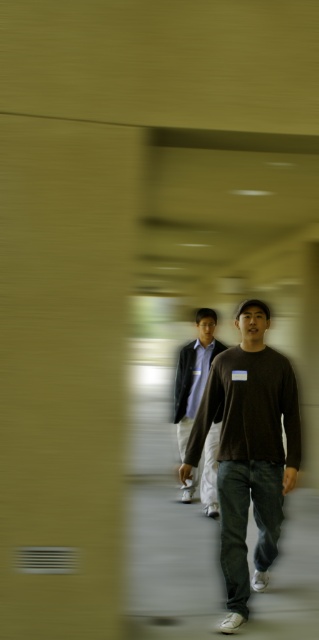
Question: Can you confirm if dark brown cotton shirt at center is bigger than matte gray sweater at center?

Choices:
 (A) no
 (B) yes

Answer: (A)

Question: Does dark brown cotton shirt at center come in front of matte gray sweater at center?

Choices:
 (A) yes
 (B) no

Answer: (A)

Question: Which point appears closest to the camera in this image?

Choices:
 (A) (x=198, y=374)
 (B) (x=213, y=413)

Answer: (B)

Question: Can you confirm if dark brown cotton shirt at center is wider than matte gray sweater at center?

Choices:
 (A) yes
 (B) no

Answer: (A)

Question: Which of the following is the farthest from the observer?

Choices:
 (A) dark brown cotton shirt at center
 (B) matte gray sweater at center

Answer: (B)